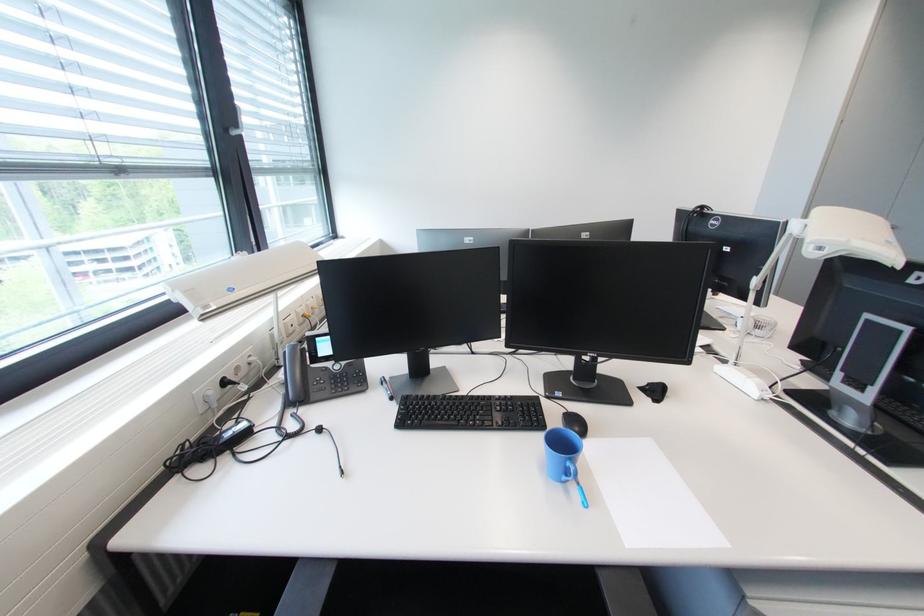
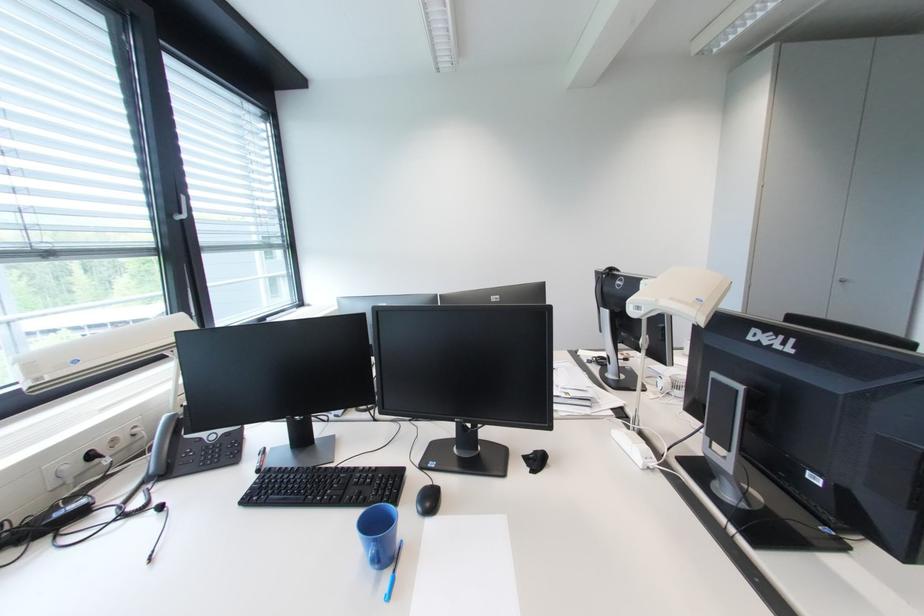
Question: Based on the continuous images, in which direction is the camera rotating? Reply with the corresponding letter.

Choices:
 (A) Left
 (B) Right
 (C) Up
 (D) Down

Answer: (C)